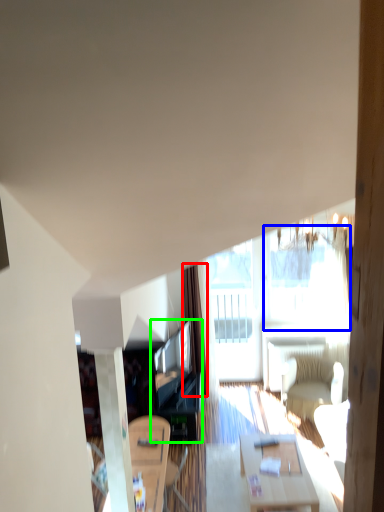
Question: Estimate the real-world distances between objects in this image. Which object is closer to curtain (highlighted by a red box), window (highlighted by a blue box) or entertainment center (highlighted by a green box)?

Choices:
 (A) window
 (B) entertainment center

Answer: (B)